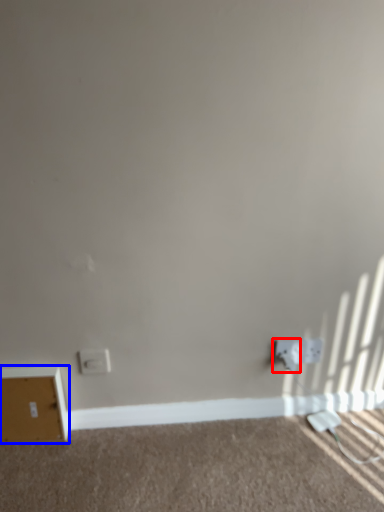
Question: Among these objects, which one is farthest to the camera, electric outlet (highlighted by a red box) or file cabinet (highlighted by a blue box)?

Choices:
 (A) electric outlet
 (B) file cabinet

Answer: (A)